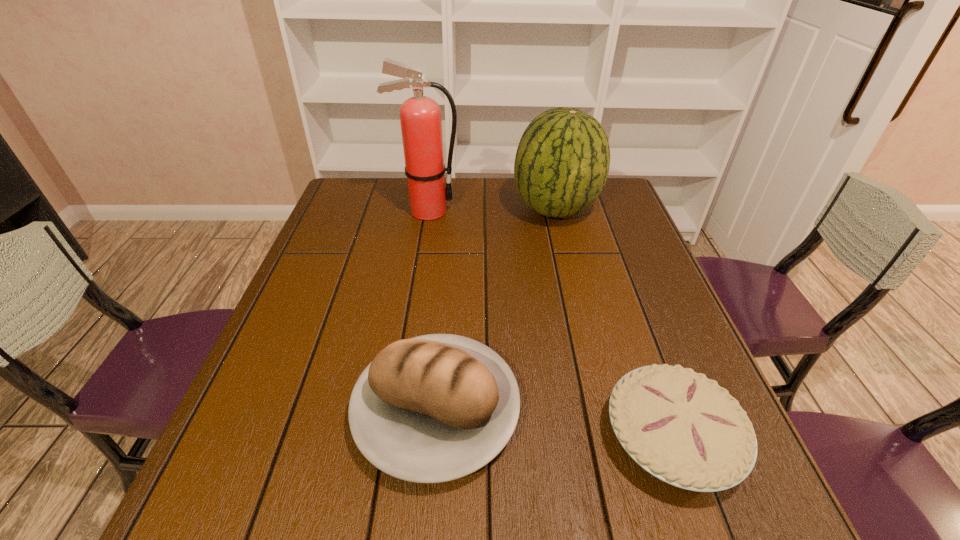
Find the location of a particular element. unoccupied position between the fire extinguisher and the watermelon is located at coordinates (492, 210).

The image size is (960, 540). I want to click on vacant space that's between the watermelon and the bread, so click(x=496, y=310).

You are a GUI agent. You are given a task and a screenshot of the screen. Output one action in this format:
    pyautogui.click(x=<x>, y=<y>)
    Task: Click on the object that is the second nearest to the pie
    
    Given the screenshot: What is the action you would take?
    pyautogui.click(x=562, y=161)

The image size is (960, 540). I want to click on the third closest object relative to the third tallest object, so click(x=420, y=117).

In order to click on vacant region that satisfies the following two spatial constraints: 1. on the hose direction of the tallest object; 2. on the right side of the pie in this screenshot , I will do `click(390, 437)`.

Locate an element on the screen. Image resolution: width=960 pixels, height=540 pixels. free space that satisfies the following two spatial constraints: 1. on the back side of the second shortest object; 2. on the hose direction of the fire extinguisher is located at coordinates (453, 211).

Identify the location of free space that satisfies the following two spatial constraints: 1. on the hose direction of the fire extinguisher; 2. on the back side of the third tallest object. Image resolution: width=960 pixels, height=540 pixels. pos(395,410).

The width and height of the screenshot is (960, 540). In order to click on free region that satisfies the following two spatial constraints: 1. on the back side of the bread; 2. on the hose direction of the tallest object in this screenshot , I will do `click(453, 211)`.

Where is `vacant space that satisfies the following two spatial constraints: 1. on the front side of the third tallest object; 2. on the right side of the pie`? vacant space that satisfies the following two spatial constraints: 1. on the front side of the third tallest object; 2. on the right side of the pie is located at coordinates (434, 437).

Identify the location of vacant space that satisfies the following two spatial constraints: 1. on the hose direction of the fire extinguisher; 2. on the left side of the pie. The image size is (960, 540). (390, 437).